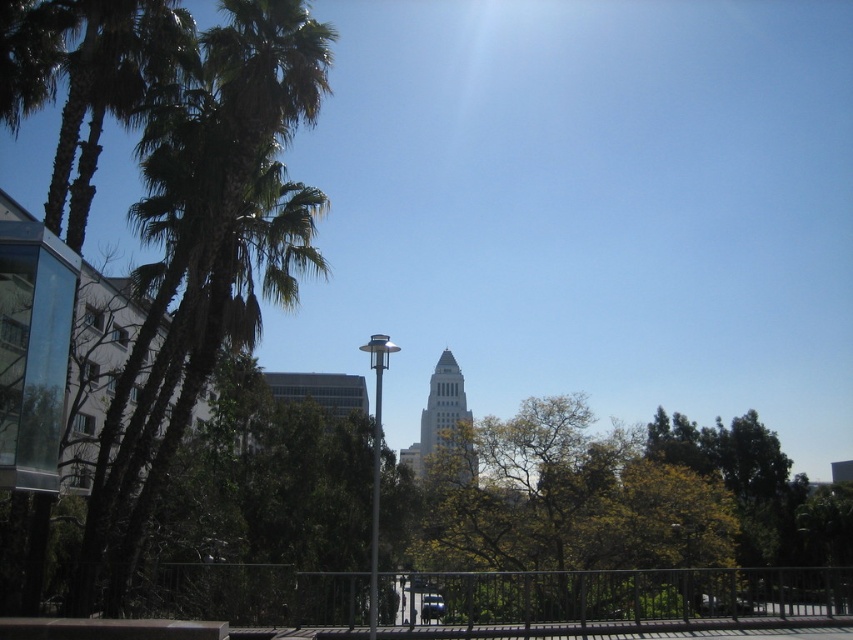
Question: Does gray stone tower at center appear over metallic silver pole at center?

Choices:
 (A) yes
 (B) no

Answer: (B)

Question: Is gray stone tower at center behind sleek metallic pole at center?

Choices:
 (A) no
 (B) yes

Answer: (B)

Question: Among these points, which one is farthest from the camera?

Choices:
 (A) (376, 515)
 (B) (375, 356)
 (C) (450, 445)
 (D) (514, 547)

Answer: (C)

Question: Which point is closer to the camera taking this photo?

Choices:
 (A) (267, 177)
 (B) (440, 602)
 (C) (379, 464)
 (D) (370, 552)

Answer: (B)

Question: Can you confirm if green leafy tree at center is positioned above sleek metallic pole at center?

Choices:
 (A) no
 (B) yes

Answer: (A)

Question: Which object is closer to the camera taking this photo?

Choices:
 (A) sleek metallic pole at center
 (B) gray stone tower at center

Answer: (A)